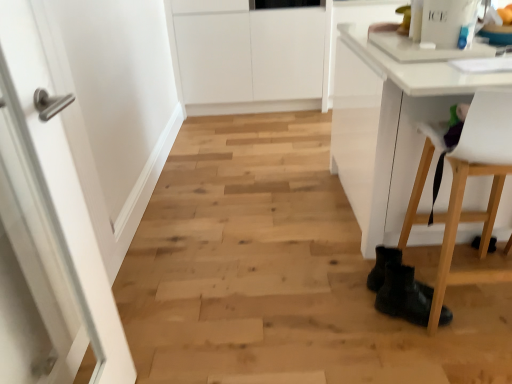
Where is `free space above black leather boots at lower right (from a real-world perspective)`? free space above black leather boots at lower right (from a real-world perspective) is located at coordinates (410, 266).